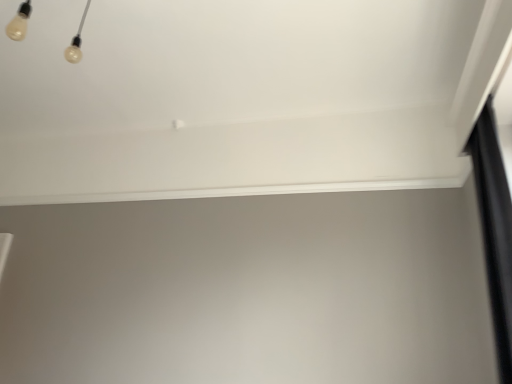
Question: Is black matte curtain at right a part of white smooth window sill at upper center?

Choices:
 (A) yes
 (B) no

Answer: (B)

Question: Is white smooth window sill at upper center aimed at black matte curtain at right?

Choices:
 (A) yes
 (B) no

Answer: (B)

Question: Is white smooth window sill at upper center closer to camera compared to black matte curtain at right?

Choices:
 (A) yes
 (B) no

Answer: (B)

Question: Is white smooth window sill at upper center to the right of black matte curtain at right from the viewer's perspective?

Choices:
 (A) no
 (B) yes

Answer: (A)

Question: Considering the relative sizes of white smooth window sill at upper center and black matte curtain at right in the image provided, is white smooth window sill at upper center taller than black matte curtain at right?

Choices:
 (A) no
 (B) yes

Answer: (A)

Question: Is white smooth window sill at upper center wider than black matte curtain at right?

Choices:
 (A) no
 (B) yes

Answer: (A)

Question: From the image's perspective, would you say black matte curtain at right is shown under white smooth window sill at upper center?

Choices:
 (A) no
 (B) yes

Answer: (B)

Question: Is black matte curtain at right completely or partially outside of white smooth window sill at upper center?

Choices:
 (A) no
 (B) yes

Answer: (B)

Question: Can you confirm if black matte curtain at right is taller than white smooth window sill at upper center?

Choices:
 (A) yes
 (B) no

Answer: (A)

Question: Could you tell me if black matte curtain at right is facing white smooth window sill at upper center?

Choices:
 (A) no
 (B) yes

Answer: (A)

Question: Is black matte curtain at right positioned with its back to white smooth window sill at upper center?

Choices:
 (A) no
 (B) yes

Answer: (A)

Question: Considering the relative sizes of black matte curtain at right and white smooth window sill at upper center in the image provided, is black matte curtain at right smaller than white smooth window sill at upper center?

Choices:
 (A) no
 (B) yes

Answer: (A)

Question: Is black matte curtain at right wider or thinner than white smooth window sill at upper center?

Choices:
 (A) thin
 (B) wide

Answer: (B)